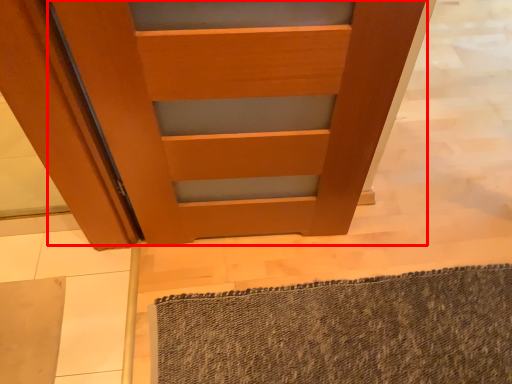
Question: From the image's perspective, what is the correct spatial relationship of door (annotated by the red box) in relation to bath mat?

Choices:
 (A) below
 (B) above

Answer: (B)